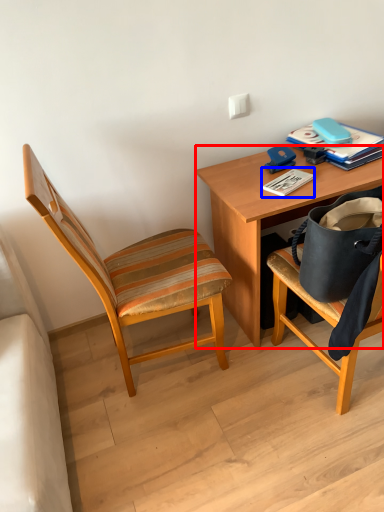
Question: Which of the following is the closest to the observer, desk (highlighted by a red box) or paperback book (highlighted by a blue box)?

Choices:
 (A) desk
 (B) paperback book

Answer: (A)